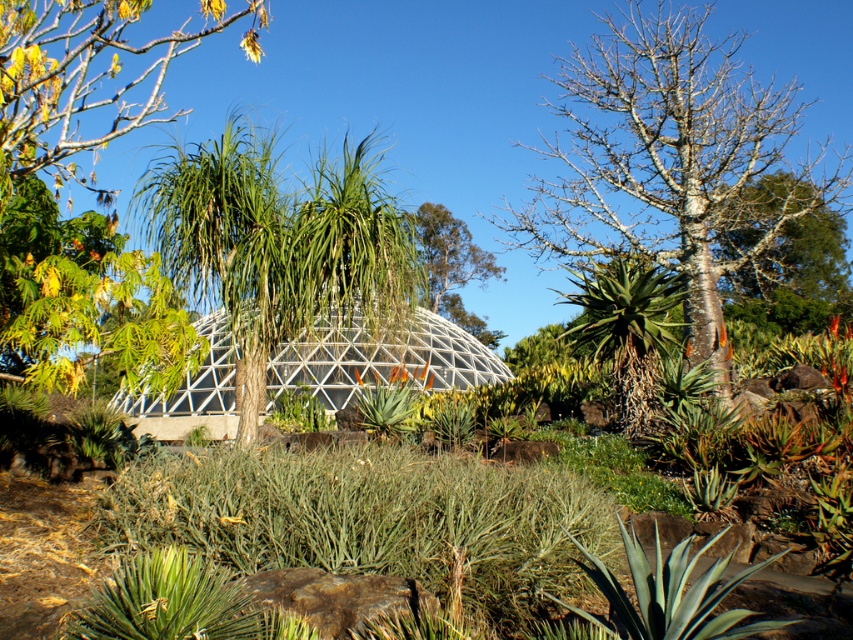
You are planning to plant a new tree in the botanical garden. The existing green leafy tree at center has a certain width. If you want to ensure the new tree doesn not block the view of the transparent glass dome at center, which object should you consider the width of when choosing the new tree?

The green leafy tree at center is thinner than the transparent glass dome at center. To ensure the new tree doesn not block the view of the transparent glass dome at center, you should consider the width of the transparent glass dome at center as a reference. The new tree should be thinner than the transparent glass dome at center to avoid blocking its view.

You are planning to plant a new tree that requires at least 10 meters of vertical space to grow. Given the current height of the green leafy tree at center and the transparent glass dome at center, can the new tree grow to its full height without hitting the dome?

The green leafy tree at center is taller than the transparent glass dome at center, so the new tree may not have enough vertical space to grow to its full height of 10 meters without potentially hitting the dome.

You are planning to place a small birdhouse between the smooth bark tree at upper right and the green leafy tree at upper center. Which tree should the birdhouse be closer to if you want it to be near the larger tree?

The smooth bark tree at upper right is bigger than the green leafy tree at upper center, so the birdhouse should be placed closer to the smooth bark tree at upper right.